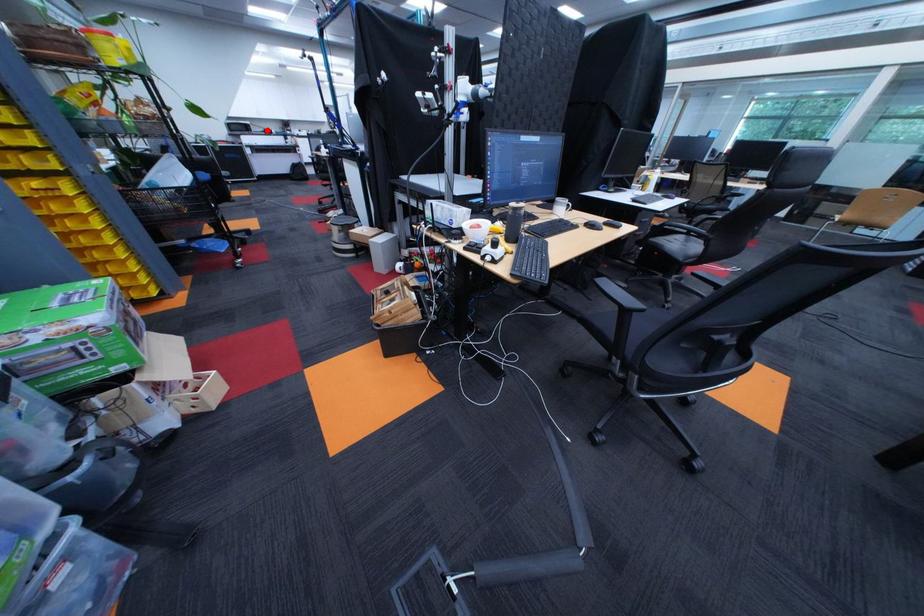
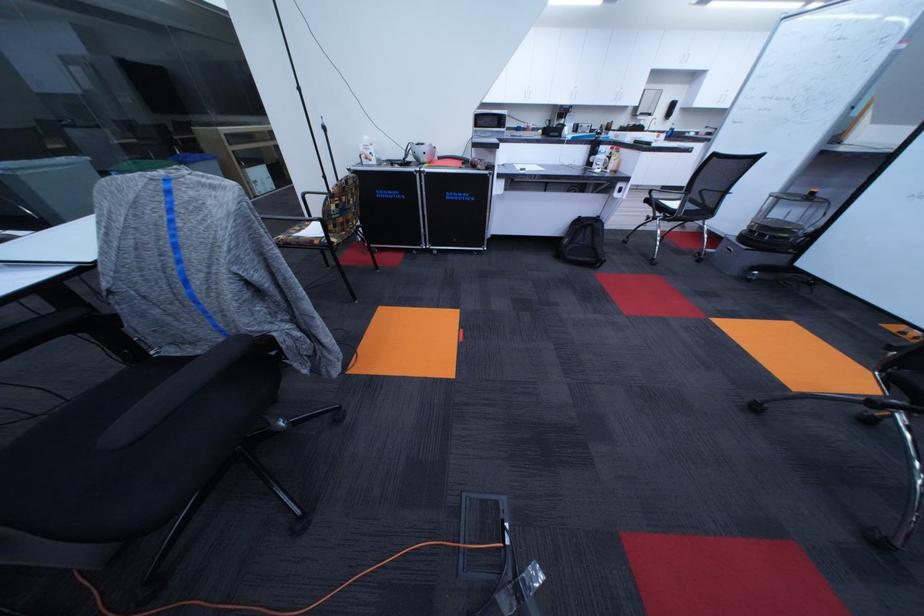
In the second image, find the point that corresponds to the highlighted location in the first image.

(521, 124)